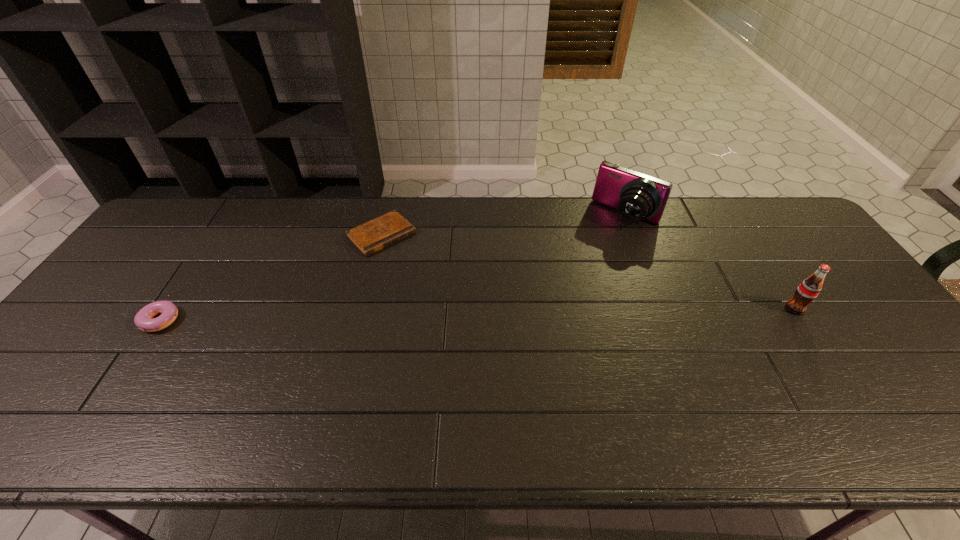
You are a GUI agent. You are given a task and a screenshot of the screen. Output one action in this format:
    pyautogui.click(x=<x>, y=<y>)
    Task: Click on the free region at the far left corner
    This screenshot has width=960, height=540.
    Given the screenshot: What is the action you would take?
    pyautogui.click(x=161, y=226)

In the image, there is a desktop. Where is `vacant space at the near left corner`? The image size is (960, 540). vacant space at the near left corner is located at coordinates (84, 376).

This screenshot has width=960, height=540. I want to click on vacant point at the far right corner, so click(748, 221).

Find the location of `free space at the near right corner`. free space at the near right corner is located at coordinates coord(939,400).

Where is `vacant region between the soda and the third object from left to right`? vacant region between the soda and the third object from left to right is located at coordinates (710, 262).

In order to click on blank region between the diary and the rightmost object in this screenshot , I will do coord(588,272).

At what (x,y) coordinates should I click in order to perform the action: click on free space between the rightmost object and the second shortest object. Please return your answer as a coordinate pair (x, y). This screenshot has width=960, height=540. Looking at the image, I should click on click(479, 313).

Find the location of `vacant area that lies between the third object from left to right and the diary`. vacant area that lies between the third object from left to right and the diary is located at coordinates (504, 226).

Find the location of `free space between the second object from right to left and the doughnut`. free space between the second object from right to left and the doughnut is located at coordinates (395, 266).

At what (x,y) coordinates should I click in order to perform the action: click on unoccupied area between the shortest object and the soda. Please return your answer as a coordinate pair (x, y). This screenshot has width=960, height=540. Looking at the image, I should click on (588, 272).